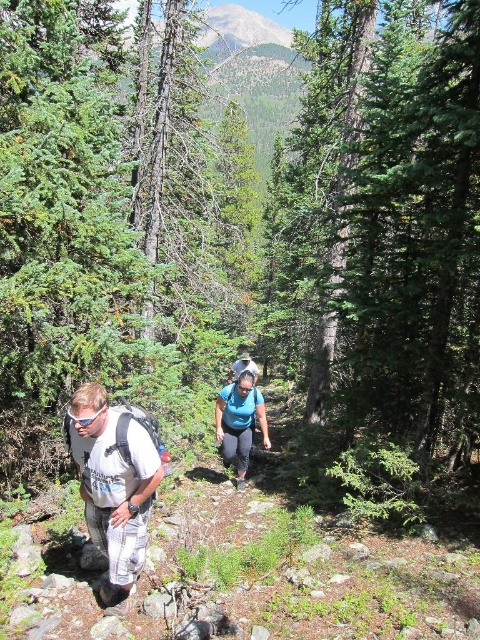
Consider the image. Who is shorter, white mesh backpack at lower left or white cotton t-shirt at lower left?

With less height is white mesh backpack at lower left.

What do you see at coordinates (116, 483) in the screenshot? I see `white mesh backpack at lower left` at bounding box center [116, 483].

Between point (100, 396) and point (139, 572), which one is positioned behind?

Positioned behind is point (139, 572).

At what (x,y) coordinates should I click in order to perform the action: click on white mesh backpack at lower left. Please return your answer as a coordinate pair (x, y). Image resolution: width=480 pixels, height=640 pixels. Looking at the image, I should click on (116, 483).

Is the position of blue fabric shirt at center more distant than that of matte black goggles at lower left?

Yes, blue fabric shirt at center is behind matte black goggles at lower left.

Who is lower down, blue fabric shirt at center or matte black goggles at lower left?

blue fabric shirt at center

Does point (240, 438) come farther from viewer compared to point (87, 417)?

Yes.

Image resolution: width=480 pixels, height=640 pixels. Identify the location of blue fabric shirt at center. (240, 422).

Which is above, white mesh backpack at lower left or blue fabric shirt at center?

Positioned higher is white mesh backpack at lower left.

Is white mesh backpack at lower left behind blue fabric shirt at center?

No, it is not.

Is point (247, 435) positioned in front of point (252, 432)?

Yes, point (247, 435) is in front of point (252, 432).

Identify the location of white mesh backpack at lower left. Image resolution: width=480 pixels, height=640 pixels. (116, 483).